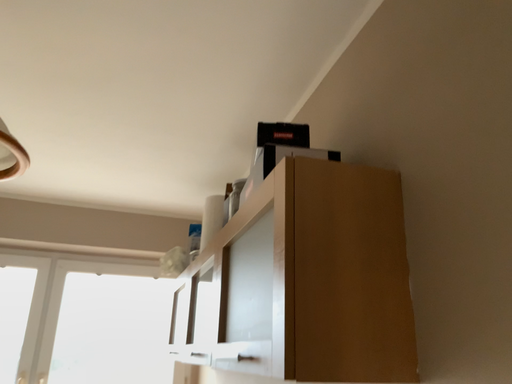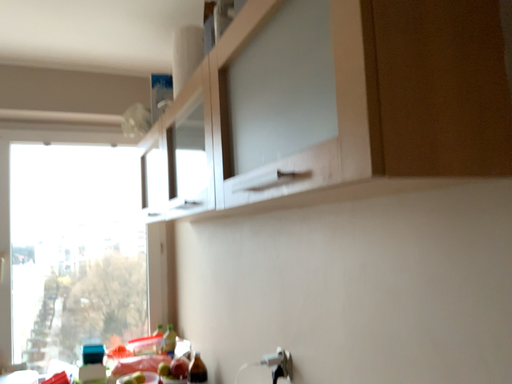
Question: Which way did the camera rotate in the video?

Choices:
 (A) rotated upward
 (B) rotated downward

Answer: (B)